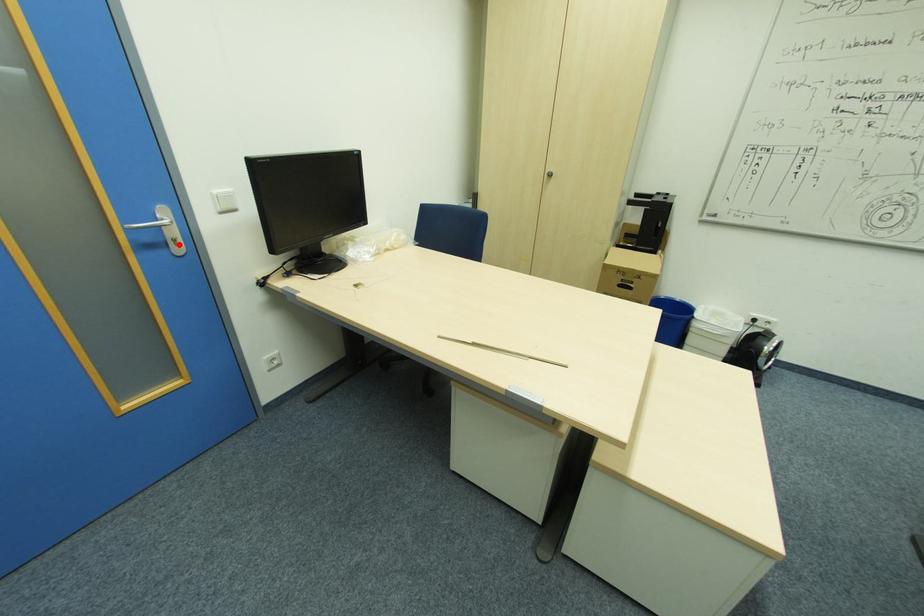
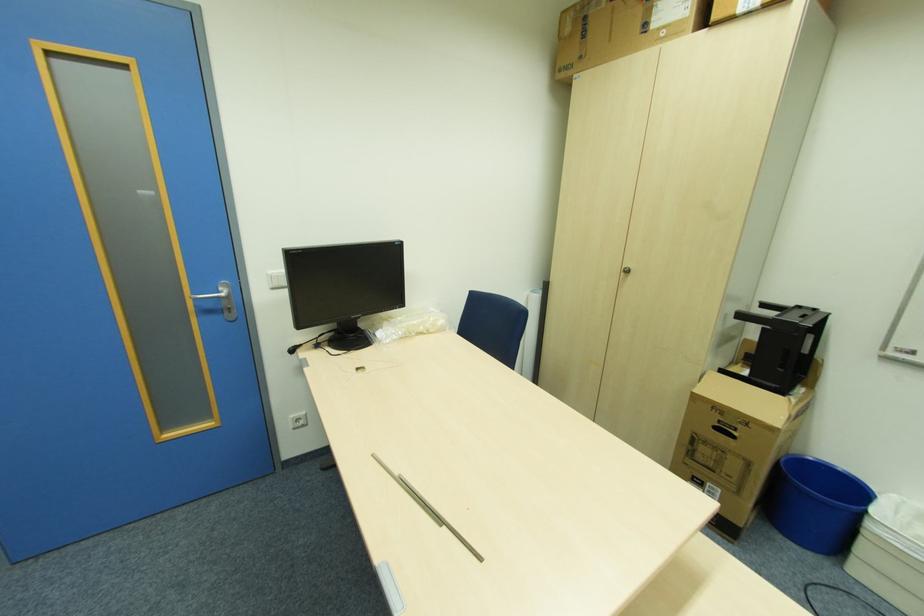
Locate, in the second image, the point that corresponds to the highlighted location in the first image.

(234, 310)